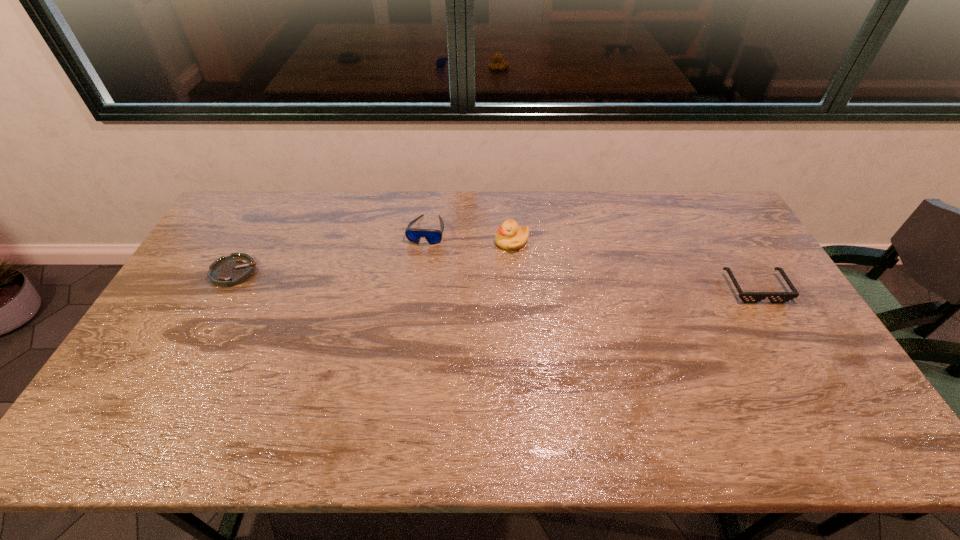
Where is `ashtray`? This screenshot has height=540, width=960. ashtray is located at coordinates (228, 271).

Find the location of a particular element. Image resolution: width=960 pixels, height=540 pixels. the shortest object is located at coordinates (228, 271).

Image resolution: width=960 pixels, height=540 pixels. I want to click on the third tallest object, so click(747, 297).

In order to click on the nearer sunglasses in this screenshot , I will do `click(747, 297)`.

This screenshot has width=960, height=540. In order to click on duckling in this screenshot , I will do `click(510, 236)`.

Locate an element on the screen. the second object from right to left is located at coordinates (510, 236).

Identify the location of the farther sunglasses. (x=433, y=236).

This screenshot has width=960, height=540. I want to click on the second object from left to right, so click(x=433, y=236).

This screenshot has width=960, height=540. In order to click on vacant area located on the right of the shortest object in this screenshot , I will do `click(349, 272)`.

Identify the location of vacant space located 0.090m on the front-facing side of the third tallest object. (779, 328).